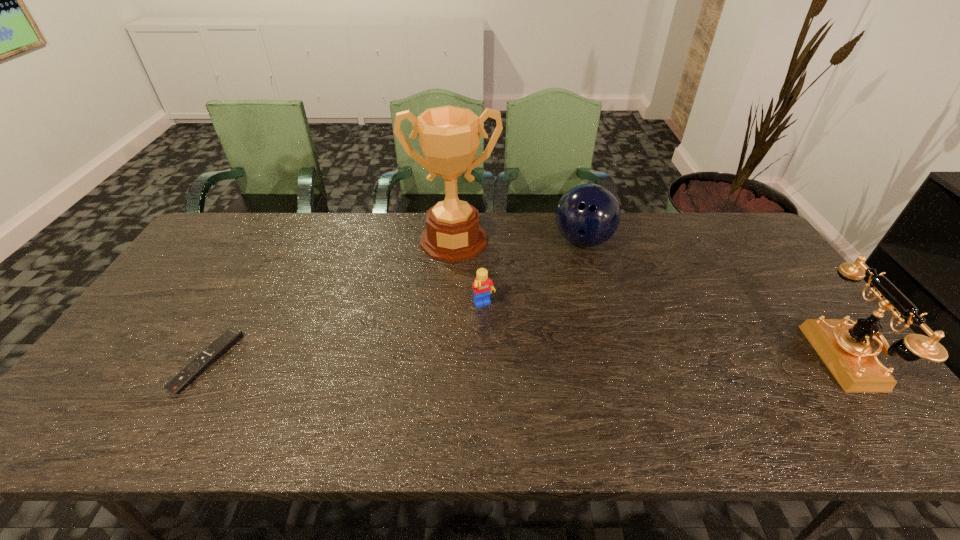
Locate an element on the screen. Image resolution: width=960 pixels, height=540 pixels. remote control located at the near edge is located at coordinates (231, 336).

Image resolution: width=960 pixels, height=540 pixels. What are the coordinates of `telephone present at the near edge` in the screenshot? It's located at (846, 349).

At what (x,y) coordinates should I click in order to perform the action: click on object present at the right edge. Please return your answer as a coordinate pair (x, y). The width and height of the screenshot is (960, 540). Looking at the image, I should click on (846, 349).

In order to click on object located in the near right corner section of the desktop in this screenshot , I will do `click(846, 349)`.

Identify the location of free space at the far edge of the desktop. (347, 221).

At what (x,y) coordinates should I click in order to perform the action: click on vacant region at the near edge. Please return your answer as a coordinate pair (x, y). The height and width of the screenshot is (540, 960). Looking at the image, I should click on (514, 384).

This screenshot has height=540, width=960. Find the location of `vacant position at the left edge of the desktop`. vacant position at the left edge of the desktop is located at coordinates (171, 346).

Find the location of a particular element. The height and width of the screenshot is (540, 960). blank space at the right edge of the desktop is located at coordinates (771, 303).

Where is `free space at the far left corner`? free space at the far left corner is located at coordinates (224, 248).

Locate an element on the screen. Image resolution: width=960 pixels, height=540 pixels. free space at the near right corner of the desktop is located at coordinates (814, 392).